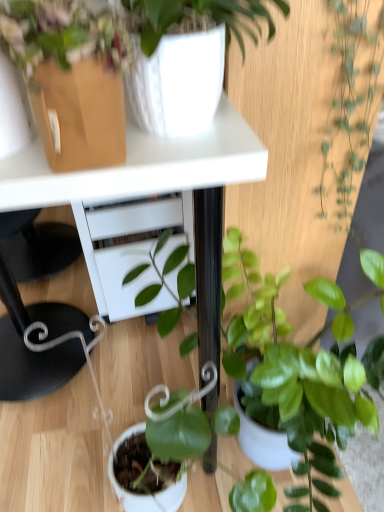
Locate an element on the screen. The height and width of the screenshot is (512, 384). green glossy plant at right, which is the first houseplant in top-to-bottom order is located at coordinates (351, 103).

In order to click on white glossy table at upper center in this screenshot , I will do `click(140, 166)`.

What are the coordinates of `green glossy plant at center, which is counted as the 3th houseplant, starting from the top` in the screenshot? It's located at (248, 280).

Where is `green glossy plant at right, which is the first houseplant in top-to-bottom order`? The height and width of the screenshot is (512, 384). green glossy plant at right, which is the first houseplant in top-to-bottom order is located at coordinates (351, 103).

How much distance is there between green glossy plant at center, which is counted as the 3th houseplant, starting from the top, and green glossy plant at right, the 3th houseplant in the bottom-to-top sequence?

green glossy plant at center, which is counted as the 3th houseplant, starting from the top, and green glossy plant at right, the 3th houseplant in the bottom-to-top sequence, are 11.91 inches apart.

From the image's perspective, does green glossy plant at center, which is counted as the 3th houseplant, starting from the top, appear higher than green glossy plant at right, which is the first houseplant in top-to-bottom order?

No, from the image's perspective, green glossy plant at center, which is counted as the 3th houseplant, starting from the top, is not above green glossy plant at right, which is the first houseplant in top-to-bottom order.

In terms of width, does green glossy plant at center, the 1th houseplant in the bottom-to-top sequence, look wider or thinner when compared to green glossy plant at right, the 3th houseplant in the bottom-to-top sequence?

Considering their sizes, green glossy plant at center, the 1th houseplant in the bottom-to-top sequence, looks broader than green glossy plant at right, the 3th houseplant in the bottom-to-top sequence.

Which point is more forward, (x=341, y=98) or (x=113, y=181)?

The point (x=113, y=181) is in front.

Is white glossy table at upper center completely or partially inside green glossy plant at right, the 3th houseplant in the bottom-to-top sequence?

No, white glossy table at upper center is located outside of green glossy plant at right, the 3th houseplant in the bottom-to-top sequence.

The height and width of the screenshot is (512, 384). In order to click on houseplant behind the white glossy table at upper center in this screenshot , I will do `click(351, 103)`.

What's the angular difference between green glossy plant at right, which is the first houseplant in top-to-bottom order, and white glossy table at upper center's facing directions?

They differ by 179 degrees in their facing directions.

Is green glossy plant at center, which is counted as the 3th houseplant, starting from the top, oriented away from white glossy vase at upper center, positioned as the second houseplant in top-to-bottom order?

No, green glossy plant at center, which is counted as the 3th houseplant, starting from the top, is not facing the opposite direction of white glossy vase at upper center, positioned as the second houseplant in top-to-bottom order.

From the image's perspective, is green glossy plant at center, the 1th houseplant in the bottom-to-top sequence, on white glossy vase at upper center, positioned as the second houseplant in top-to-bottom order?

Incorrect, from the image's perspective, green glossy plant at center, the 1th houseplant in the bottom-to-top sequence, is lower than white glossy vase at upper center, positioned as the second houseplant in top-to-bottom order.

In terms of height, does green glossy plant at center, the 1th houseplant in the bottom-to-top sequence, look taller or shorter compared to white glossy vase at upper center, positioned as the second houseplant in top-to-bottom order?

Considering their sizes, green glossy plant at center, the 1th houseplant in the bottom-to-top sequence, has more height than white glossy vase at upper center, positioned as the second houseplant in top-to-bottom order.

The image size is (384, 512). Find the location of `houseplant below the white glossy vase at upper center, positioned as the second houseplant in top-to-bottom order (from the image's perspective)`. houseplant below the white glossy vase at upper center, positioned as the second houseplant in top-to-bottom order (from the image's perspective) is located at coordinates (248, 280).

Between white glossy vase at upper center, which ranks as the 2th houseplant in bottom-to-top order, and green glossy plant at right, the 3th houseplant in the bottom-to-top sequence, which one appears on the left side from the viewer's perspective?

From the viewer's perspective, white glossy vase at upper center, which ranks as the 2th houseplant in bottom-to-top order, appears more on the left side.

Can you confirm if white glossy vase at upper center, positioned as the second houseplant in top-to-bottom order, is taller than green glossy plant at right, which is the first houseplant in top-to-bottom order?

In fact, white glossy vase at upper center, positioned as the second houseplant in top-to-bottom order, may be shorter than green glossy plant at right, which is the first houseplant in top-to-bottom order.

Is white glossy vase at upper center, positioned as the second houseplant in top-to-bottom order, closer to camera compared to green glossy plant at right, which is the first houseplant in top-to-bottom order?

Yes, white glossy vase at upper center, positioned as the second houseplant in top-to-bottom order, is closer to the viewer.

Would you say white glossy vase at upper center, which ranks as the 2th houseplant in bottom-to-top order, is outside green glossy plant at right, the 3th houseplant in the bottom-to-top sequence?

Yes, white glossy vase at upper center, which ranks as the 2th houseplant in bottom-to-top order, is located beyond the bounds of green glossy plant at right, the 3th houseplant in the bottom-to-top sequence.

How many degrees apart are the facing directions of white glossy table at upper center and green glossy plant at right, which is the first houseplant in top-to-bottom order?

179 degrees separate the facing orientations of white glossy table at upper center and green glossy plant at right, which is the first houseplant in top-to-bottom order.

Is white glossy table at upper center situated inside green glossy plant at right, which is the first houseplant in top-to-bottom order, or outside?

white glossy table at upper center is not enclosed by green glossy plant at right, which is the first houseplant in top-to-bottom order.

Is white glossy table at upper center positioned with its back to green glossy plant at right, the 3th houseplant in the bottom-to-top sequence?

Yes, white glossy table at upper center's orientation is away from green glossy plant at right, the 3th houseplant in the bottom-to-top sequence.

Considering the sizes of objects white glossy table at upper center and green glossy plant at right, the 3th houseplant in the bottom-to-top sequence, in the image provided, who is bigger, white glossy table at upper center or green glossy plant at right, the 3th houseplant in the bottom-to-top sequence,?

With larger size is white glossy table at upper center.

From the image's perspective, which is above, green glossy plant at right, which is the first houseplant in top-to-bottom order, or white glossy vase at upper center, positioned as the second houseplant in top-to-bottom order?

green glossy plant at right, which is the first houseplant in top-to-bottom order.

Could you tell me if green glossy plant at right, which is the first houseplant in top-to-bottom order, is turned towards white glossy vase at upper center, positioned as the second houseplant in top-to-bottom order?

No.

From a real-world perspective, does green glossy plant at right, the 3th houseplant in the bottom-to-top sequence, stand above white glossy vase at upper center, positioned as the second houseplant in top-to-bottom order?

No, from a real-world perspective, green glossy plant at right, the 3th houseplant in the bottom-to-top sequence, is not over white glossy vase at upper center, positioned as the second houseplant in top-to-bottom order

Can you confirm if green glossy plant at right, which is the first houseplant in top-to-bottom order, is positioned to the right of white glossy vase at upper center, which ranks as the 2th houseplant in bottom-to-top order?

Yes, green glossy plant at right, which is the first houseplant in top-to-bottom order, is to the right of white glossy vase at upper center, which ranks as the 2th houseplant in bottom-to-top order.

From the image's perspective, is green glossy plant at right, the 3th houseplant in the bottom-to-top sequence, above or below green glossy plant at center, which is counted as the 3th houseplant, starting from the top?

Clearly, from the image's perspective, green glossy plant at right, the 3th houseplant in the bottom-to-top sequence, is above green glossy plant at center, which is counted as the 3th houseplant, starting from the top.

Considering the sizes of objects green glossy plant at right, which is the first houseplant in top-to-bottom order, and green glossy plant at center, the 1th houseplant in the bottom-to-top sequence, in the image provided, who is bigger, green glossy plant at right, which is the first houseplant in top-to-bottom order, or green glossy plant at center, the 1th houseplant in the bottom-to-top sequence,?

Bigger between the two is green glossy plant at center, the 1th houseplant in the bottom-to-top sequence.

Can you confirm if green glossy plant at right, the 3th houseplant in the bottom-to-top sequence, is positioned to the left of green glossy plant at center, the 1th houseplant in the bottom-to-top sequence?

Yes.

This screenshot has height=512, width=384. In order to click on the 2nd houseplant below when counting from the green glossy plant at right, which is the first houseplant in top-to-bottom order (from the image's perspective) in this screenshot , I will do `click(248, 280)`.

This screenshot has width=384, height=512. What are the coordinates of `the 2nd houseplant below when counting from the green glossy plant at right, which is the first houseplant in top-to-bottom order (from the image's perspective)` in the screenshot? It's located at (248, 280).

From the image's perspective, which houseplant is the 2nd one above the white glossy table at upper center? Please provide its 2D coordinates.

[(351, 103)]

Looking at the image, which one is located further to white glossy vase at upper center, positioned as the second houseplant in top-to-bottom order, green glossy plant at center, which is counted as the 3th houseplant, starting from the top, or green glossy plant at right, which is the first houseplant in top-to-bottom order?

Among the two, green glossy plant at center, which is counted as the 3th houseplant, starting from the top, is located further to white glossy vase at upper center, positioned as the second houseplant in top-to-bottom order.

Based on their spatial positions, is white glossy table at upper center or white glossy vase at upper center, which ranks as the 2th houseplant in bottom-to-top order, closer to green glossy plant at center, which is counted as the 3th houseplant, starting from the top?

white glossy table at upper center is positioned closer to the anchor green glossy plant at center, which is counted as the 3th houseplant, starting from the top.

Considering their positions, is white glossy table at upper center positioned further to green glossy plant at right, which is the first houseplant in top-to-bottom order, than green glossy plant at center, the 1th houseplant in the bottom-to-top sequence?

white glossy table at upper center is positioned further to the anchor green glossy plant at right, which is the first houseplant in top-to-bottom order.

Estimate the real-world distances between objects in this image. Which object is closer to white glossy vase at upper center, positioned as the second houseplant in top-to-bottom order, white glossy table at upper center or green glossy plant at center, which is counted as the 3th houseplant, starting from the top?

Based on the image, white glossy table at upper center appears to be nearer to white glossy vase at upper center, positioned as the second houseplant in top-to-bottom order.

Based on their spatial positions, is green glossy plant at right, the 3th houseplant in the bottom-to-top sequence, or white glossy table at upper center closer to white glossy vase at upper center, which ranks as the 2th houseplant in bottom-to-top order?

white glossy table at upper center lies closer to white glossy vase at upper center, which ranks as the 2th houseplant in bottom-to-top order, than the other object.

Estimate the real-world distances between objects in this image. Which object is closer to white glossy table at upper center, white glossy vase at upper center, positioned as the second houseplant in top-to-bottom order, or green glossy plant at right, the 3th houseplant in the bottom-to-top sequence?

Based on the image, white glossy vase at upper center, positioned as the second houseplant in top-to-bottom order, appears to be nearer to white glossy table at upper center.

When comparing their distances from green glossy plant at center, which is counted as the 3th houseplant, starting from the top, does green glossy plant at right, the 3th houseplant in the bottom-to-top sequence, or white glossy table at upper center seem closer?

Among the two, green glossy plant at right, the 3th houseplant in the bottom-to-top sequence, is located nearer to green glossy plant at center, which is counted as the 3th houseplant, starting from the top.

Considering their positions, is white glossy vase at upper center, which ranks as the 2th houseplant in bottom-to-top order, positioned closer to green glossy plant at center, the 1th houseplant in the bottom-to-top sequence, than green glossy plant at right, which is the first houseplant in top-to-bottom order?

Among the two, green glossy plant at right, which is the first houseplant in top-to-bottom order, is located nearer to green glossy plant at center, the 1th houseplant in the bottom-to-top sequence.

I want to click on houseplant between white glossy table at upper center and green glossy plant at right, the 3th houseplant in the bottom-to-top sequence, so click(61, 37).

Locate an element on the screen. The width and height of the screenshot is (384, 512). houseplant between green glossy plant at right, which is the first houseplant in top-to-bottom order, and green glossy plant at center, which is counted as the 3th houseplant, starting from the top, vertically is located at coordinates (61, 37).